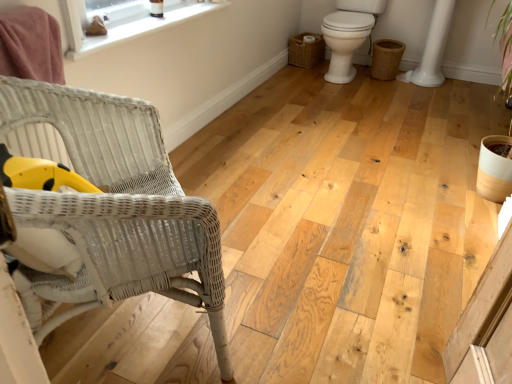
This screenshot has width=512, height=384. I want to click on vacant point to the left of white glossy toilet at right, so click(286, 81).